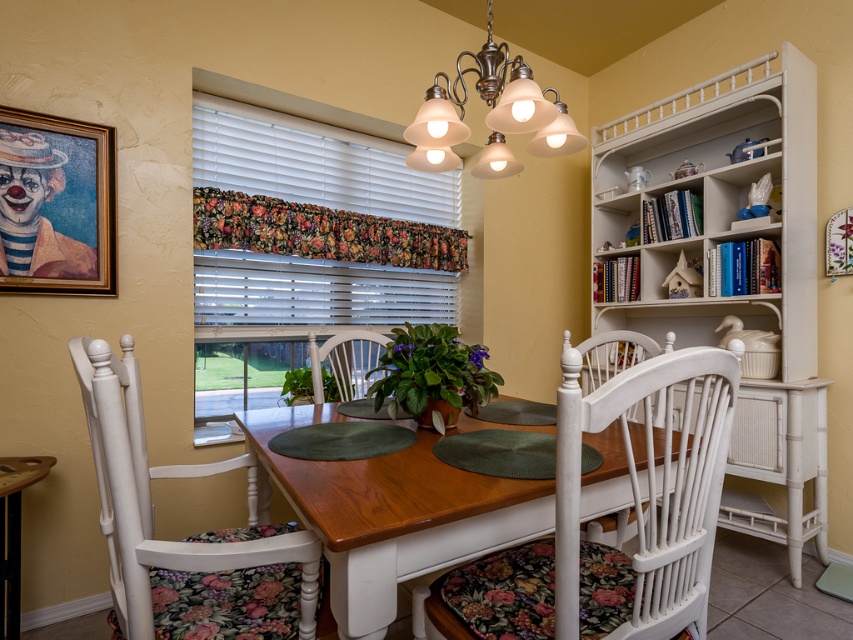
Which of these two, white blinds at upper center or floral fabric valance at upper center, stands shorter?

With less height is floral fabric valance at upper center.

How far apart are white blinds at upper center and floral fabric valance at upper center?

A distance of 9.01 inches exists between white blinds at upper center and floral fabric valance at upper center.

Who is more distant from viewer, (328, 148) or (306, 248)?

The point (328, 148) is behind.

The width and height of the screenshot is (853, 640). Identify the location of white blinds at upper center. (314, 163).

Is white blinds at upper center to the left of metallic frosted glass chandelier at upper center from the viewer's perspective?

Correct, you'll find white blinds at upper center to the left of metallic frosted glass chandelier at upper center.

Between white blinds at upper center and metallic frosted glass chandelier at upper center, which one appears on the right side from the viewer's perspective?

metallic frosted glass chandelier at upper center is more to the right.

What do you see at coordinates (314, 163) in the screenshot?
I see `white blinds at upper center` at bounding box center [314, 163].

Where is `white blinds at upper center`? Image resolution: width=853 pixels, height=640 pixels. white blinds at upper center is located at coordinates (314, 163).

Who is positioned more to the right, white painted wood bookshelf at upper right or metallic frosted glass chandelier at upper center?

Positioned to the right is white painted wood bookshelf at upper right.

Which is above, white painted wood bookshelf at upper right or metallic frosted glass chandelier at upper center?

Positioned higher is metallic frosted glass chandelier at upper center.

Is point (692, 109) positioned in front of point (488, 170)?

No, (692, 109) is behind (488, 170).

At what (x,y) coordinates should I click in order to perform the action: click on white painted wood bookshelf at upper right. Please return your answer as a coordinate pair (x, y). This screenshot has width=853, height=640. Looking at the image, I should click on (726, 264).